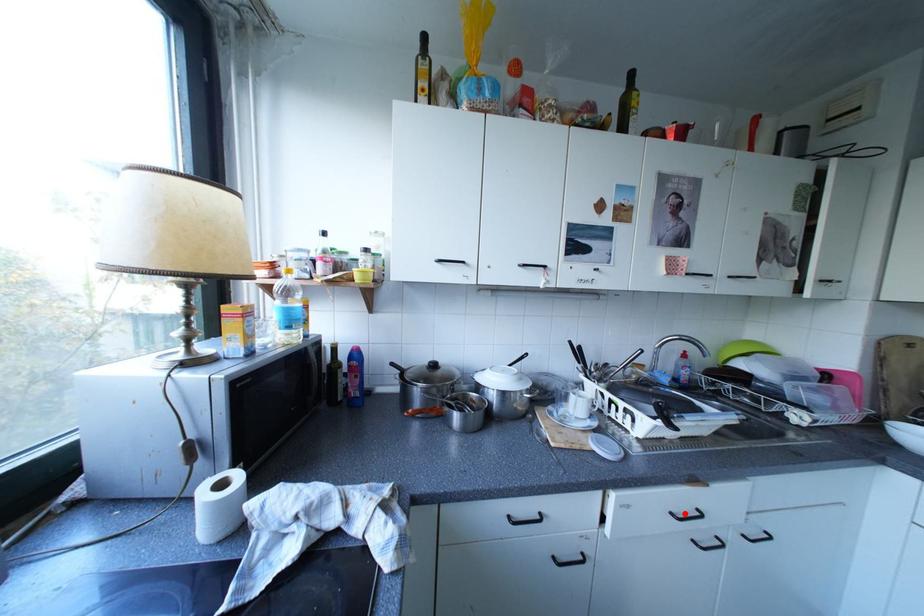
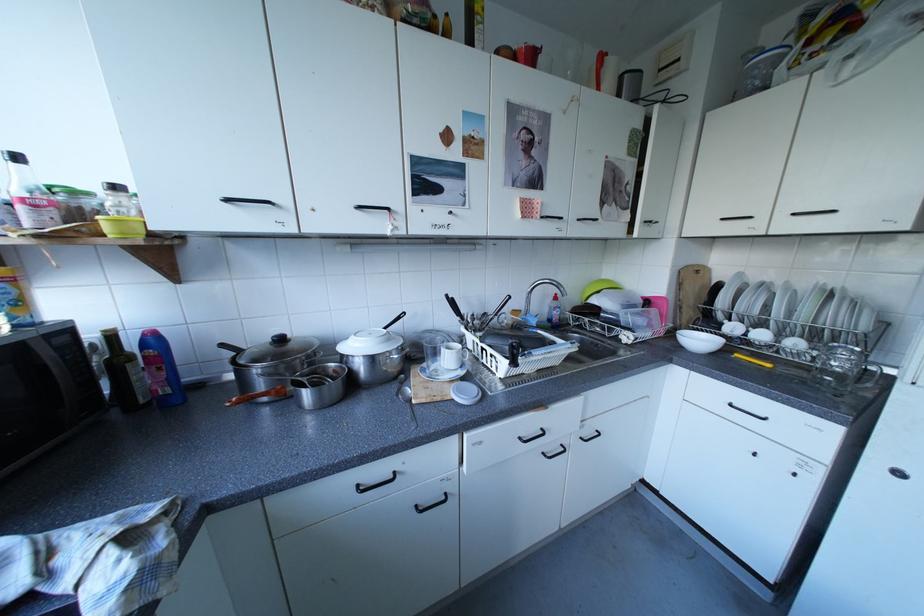
Where in the second image is the point corresponding to the highlighted location from the first image?

(532, 439)